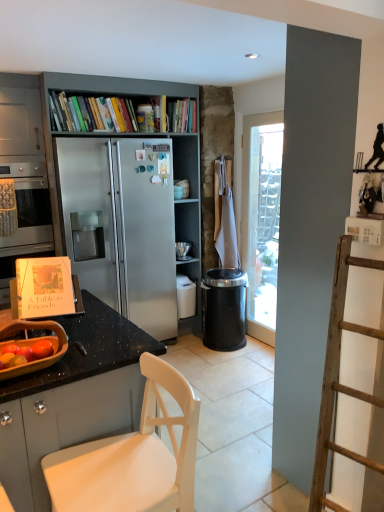
Question: In terms of width, does black plastic trash can at center-right look wider or thinner when compared to hardcover book at upper center, which is the first book from right to left?

Choices:
 (A) thin
 (B) wide

Answer: (B)

Question: From a real-world perspective, is black plastic trash can at center-right physically located above or below hardcover book at upper center, which ranks as the 2th book in left-to-right order?

Choices:
 (A) above
 (B) below

Answer: (B)

Question: Considering the real-world distances, which object is closest to the black granite countertop at lower left?

Choices:
 (A) white matte chair at lower left
 (B) stainless steel oven at left
 (C) metallic gray bookcase at center
 (D) hardcover book at upper center, which ranks as the 2th book in left-to-right order
 (E) black plastic trash can at center-right

Answer: (A)

Question: Which object is the farthest from the black glossy shelf at upper right?

Choices:
 (A) hardcover book at upper center, which is the first book from right to left
 (B) metallic gray bookcase at center
 (C) black granite countertop at lower left
 (D) white matte chair at lower left
 (E) stainless steel oven at left

Answer: (E)